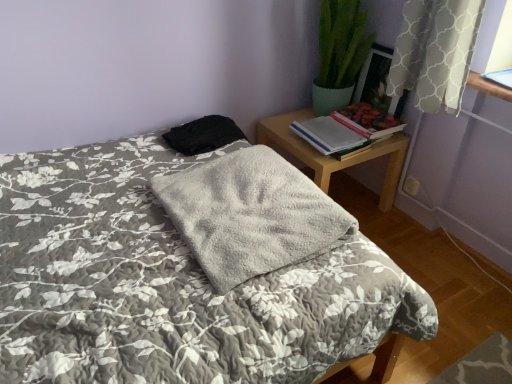
Question: Considering the relative sizes of white paper book at right, the 2th book from the right, and fluffy gray blanket at center in the image provided, is white paper book at right, the 2th book from the right, bigger than fluffy gray blanket at center?

Choices:
 (A) no
 (B) yes

Answer: (A)

Question: Does white paper book at right, the 2th book from the right, turn towards fluffy gray blanket at center?

Choices:
 (A) no
 (B) yes

Answer: (A)

Question: Does white paper book at right, the 2th book from the right, appear on the right side of fluffy gray blanket at center?

Choices:
 (A) yes
 (B) no

Answer: (A)

Question: From a real-world perspective, is white paper book at right, the first book positioned from the left, under fluffy gray blanket at center?

Choices:
 (A) yes
 (B) no

Answer: (B)

Question: Considering the relative sizes of white paper book at right, the first book positioned from the left, and fluffy gray blanket at center in the image provided, is white paper book at right, the first book positioned from the left, taller than fluffy gray blanket at center?

Choices:
 (A) no
 (B) yes

Answer: (A)

Question: Is white paper book at right, the 2th book from the right, touching fluffy gray blanket at center?

Choices:
 (A) yes
 (B) no

Answer: (B)

Question: Is hardcover book at upper right, which is the 2th book from left to right, at the right side of black fabric at upper center?

Choices:
 (A) yes
 (B) no

Answer: (A)

Question: Can you confirm if hardcover book at upper right, which is the 2th book from left to right, is smaller than black fabric at upper center?

Choices:
 (A) no
 (B) yes

Answer: (B)

Question: From a real-world perspective, is hardcover book at upper right, which is the first book from right to left, physically above black fabric at upper center?

Choices:
 (A) no
 (B) yes

Answer: (A)

Question: From the image's perspective, is hardcover book at upper right, which is the 2th book from left to right, beneath black fabric at upper center?

Choices:
 (A) no
 (B) yes

Answer: (A)

Question: Is hardcover book at upper right, which is the first book from right to left, wider than black fabric at upper center?

Choices:
 (A) yes
 (B) no

Answer: (B)

Question: Is hardcover book at upper right, which is the 2th book from left to right, positioned behind black fabric at upper center?

Choices:
 (A) no
 (B) yes

Answer: (B)

Question: Could you tell me if wooden nightstand at upper right is facing black fabric at upper center?

Choices:
 (A) no
 (B) yes

Answer: (B)